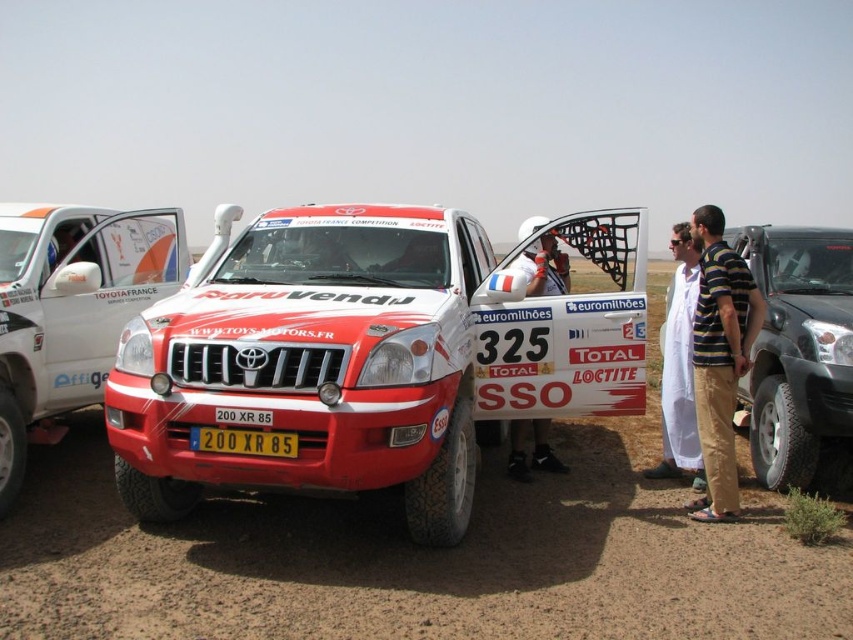
You are a photographer positioned at the back of the scene. You want to take a photo of the matte white suv at center without the white fabric at center blocking the view. Is this possible?

The matte white suv at center is in front of the white fabric at center, so the suv will block the fabric, making it possible to take a photo of the matte white suv at center without the white fabric at center blocking the view.

You are a photographer at the rally event and need to capture the entire white fabric at center and yellow metallic license plate at center in one frame. Given that your camera has a fixed field of view, which object should you position closer to the camera to ensure both are fully visible?

The white fabric at center has a larger width than the yellow metallic license plate at center. To ensure both are fully visible in the frame, you should position the white fabric at center closer to the camera since its larger size requires more space in the field of view.

You are a photographer setting up equipment for the rally event. You have a matte white suv at center and a white fabric at center in your view. Which object is wider from your perspective?

The matte white suv at center might be wider than white fabric at center according to the description.